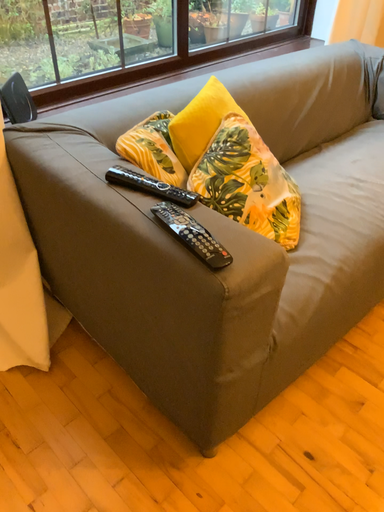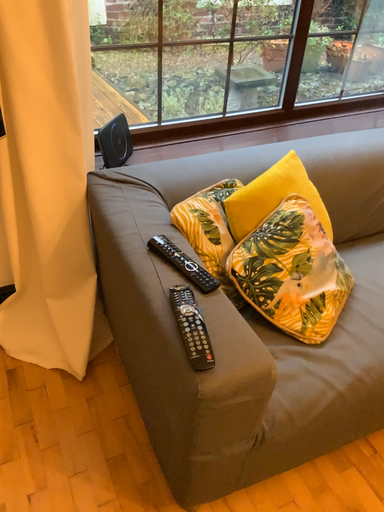
Question: Which way did the camera rotate in the video?

Choices:
 (A) rotated right
 (B) rotated left

Answer: (B)